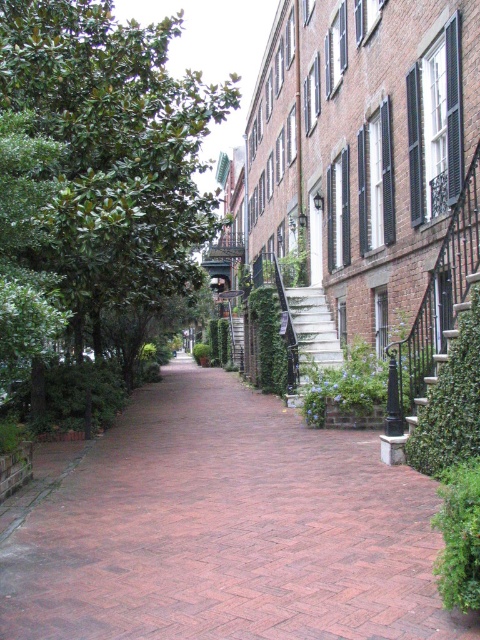
You are standing at the entrance of the alley and see two points marked in the image. The first point is at coordinate point(478, 524) and the second is at point(236, 332). Which point is closer to you?

Point(478, 524) is in front of point(236, 332), so the first point is closer to you.

You are standing in the alley and want to take a photo of the historic brick buildings. You need to position yourself so that both the brick paved walkway at center and the white concrete stairs at center are visible in the frame. Which object should you place closer to the front of the photo?

The brick paved walkway at center is closer to the viewer than the white concrete stairs at center, so to have both in the frame, position yourself so the brick paved walkway at center is near the front while the white concrete stairs at center will naturally appear further back in the photo.